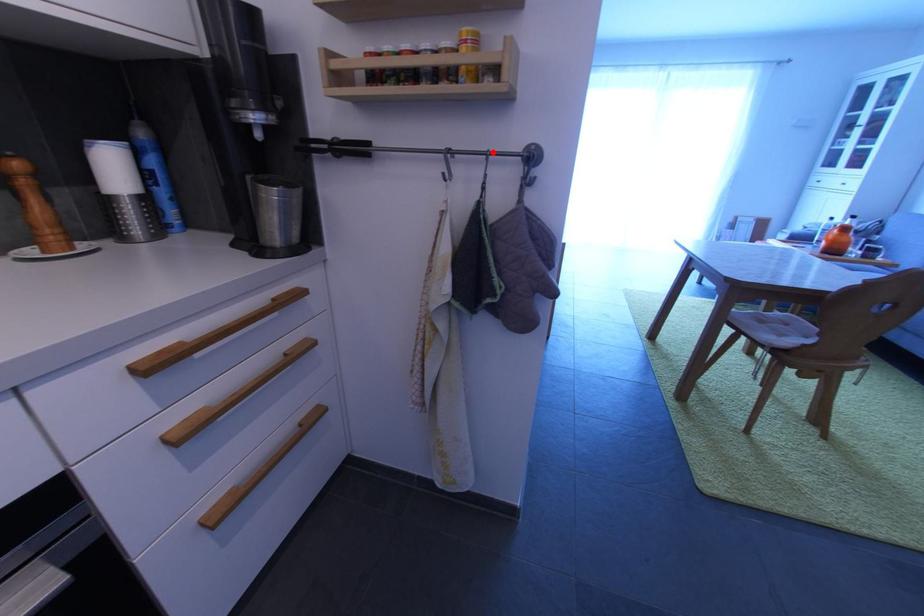
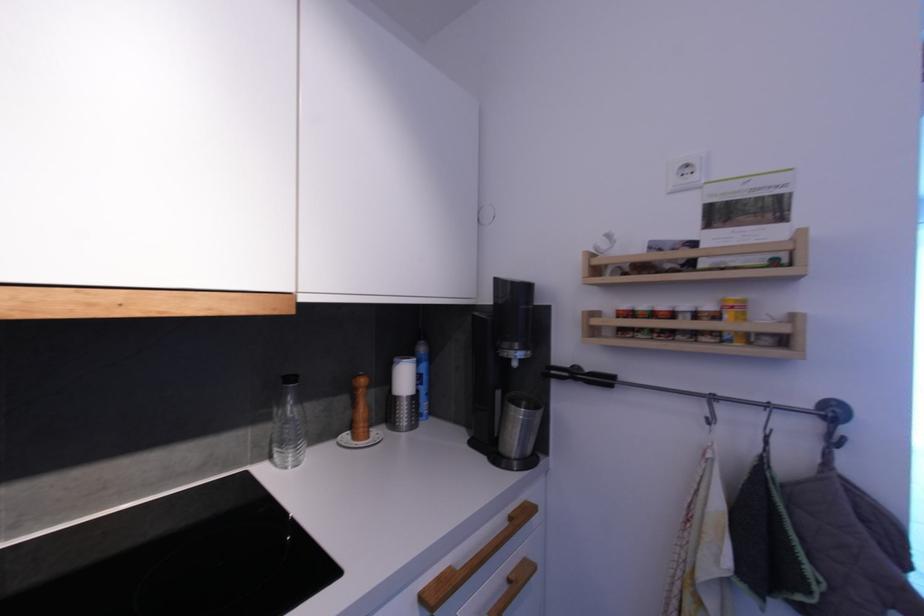
Find the pixel in the second image that matches the highlighted location in the first image.

(773, 405)